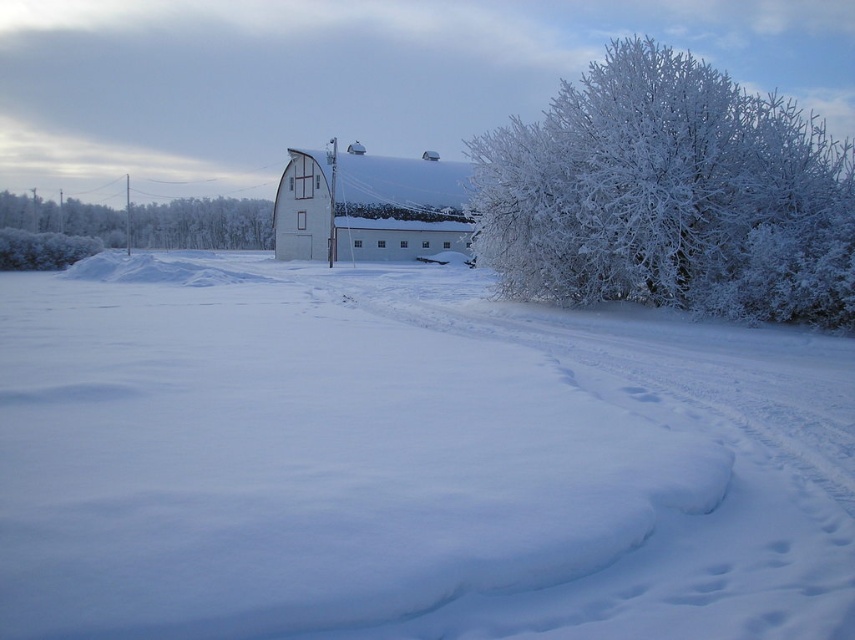
Question: Can you confirm if white matte barn at center is wider than white frosty bush at left?

Choices:
 (A) no
 (B) yes

Answer: (A)

Question: Which is nearer to the white frosty bush at left?

Choices:
 (A) white fluffy snow at center
 (B) frosted white bush at right
 (C) white matte barn at center

Answer: (C)

Question: Is white matte barn at center to the right of white frosty bush at left from the viewer's perspective?

Choices:
 (A) yes
 (B) no

Answer: (A)

Question: Can you confirm if white fluffy snow at center is positioned to the left of white matte barn at center?

Choices:
 (A) no
 (B) yes

Answer: (B)

Question: Which point is farther to the camera?

Choices:
 (A) white matte barn at center
 (B) white frosty bush at left
 (C) frosted white bush at right

Answer: (B)

Question: Which point is closer to the camera?

Choices:
 (A) frosted white bush at right
 (B) white fluffy snow at center
 (C) white frosty bush at left

Answer: (B)